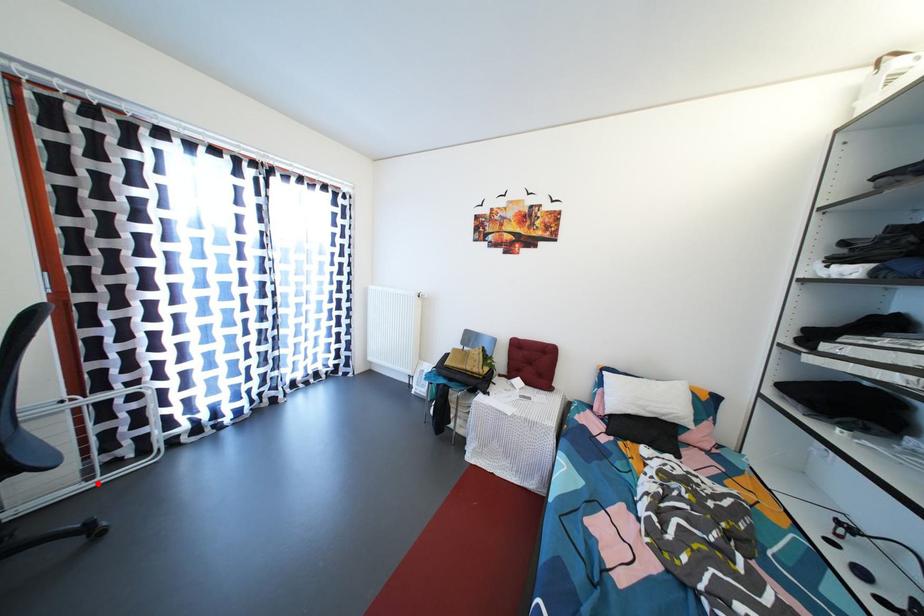
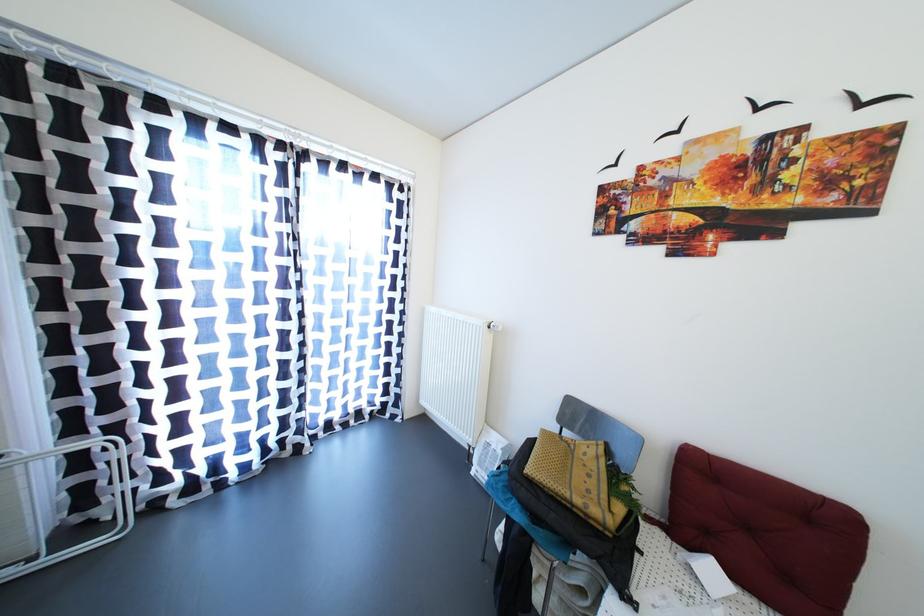
Find the pixel in the second image that matches the highlighted location in the first image.

(39, 564)